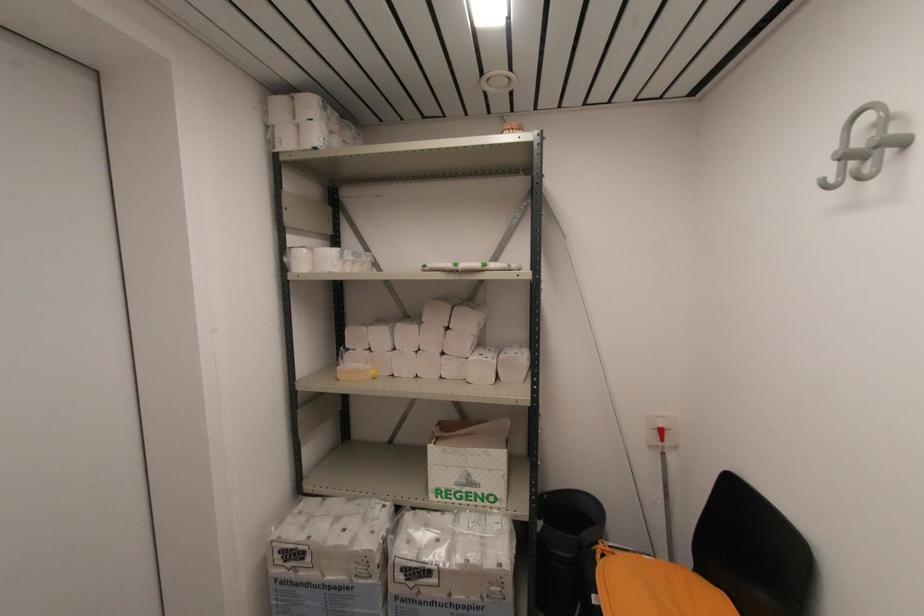
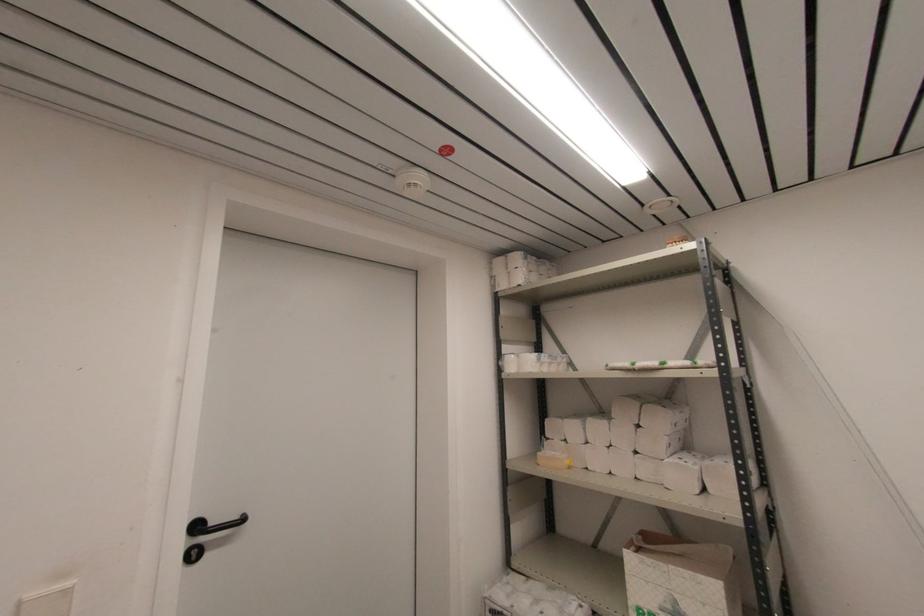
Locate, in the second image, the point that corresponds to (465,480) in the first image.

(671, 609)